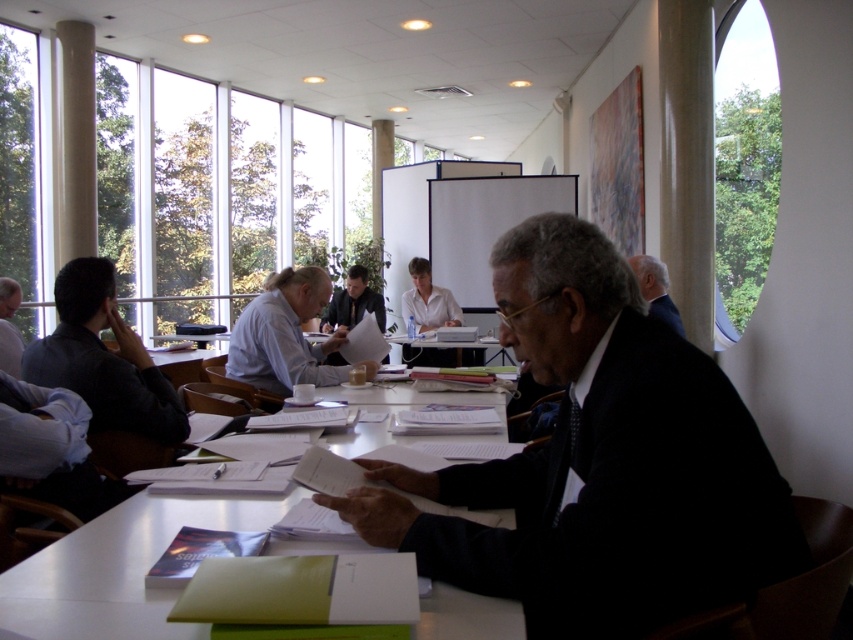
Is point (79, 308) positioned after point (364, 276)?

No, it is not.

Between point (30, 378) and point (325, 310), which one is positioned in front?

Point (30, 378) is in front.

Identify the location of matte black shirt at left. This screenshot has width=853, height=640. (103, 358).

Consider the image. Can you confirm if matte blue shirt at center is taller than dark blue shirt at left?

Yes, matte blue shirt at center is taller than dark blue shirt at left.

Can you confirm if matte blue shirt at center is wider than dark blue shirt at left?

Correct, the width of matte blue shirt at center exceeds that of dark blue shirt at left.

You are a GUI agent. You are given a task and a screenshot of the screen. Output one action in this format:
    pyautogui.click(x=<x>, y=<y>)
    Task: Click on the matte blue shirt at center
    This screenshot has width=853, height=640.
    Given the screenshot: What is the action you would take?
    click(x=283, y=333)

Which of these two, dark suit at center or dark blue suit at right, stands shorter?

dark blue suit at right is shorter.

Is point (631, 406) closer to camera compared to point (672, 320)?

Yes, it is in front of point (672, 320).

Image resolution: width=853 pixels, height=640 pixels. I want to click on dark suit at center, so click(599, 464).